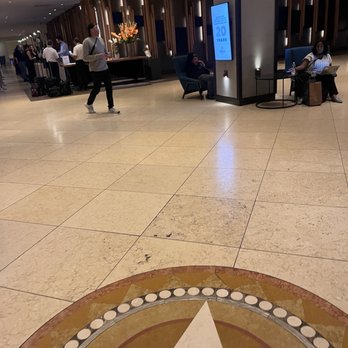
I want to click on screen, so click(223, 37).